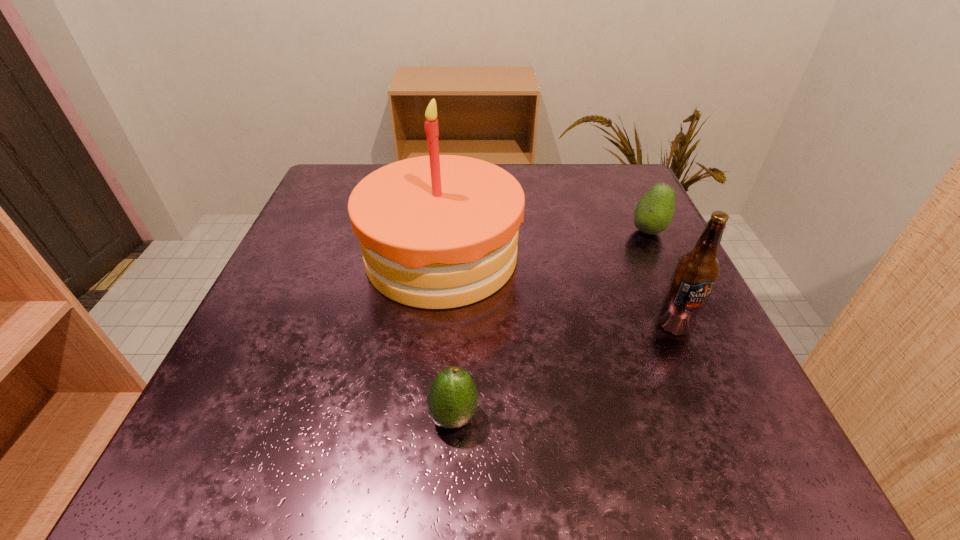
Find the location of a particular element. Image resolution: width=960 pixels, height=540 pixels. object that is the nearest to the tallest object is located at coordinates (452, 397).

Locate which object ranks second in proximity to the nearer avocado. Please provide its 2D coordinates. Your answer should be formatted as a tuple, i.e. [(x, y)], where the tuple contains the x and y coordinates of a point satisfying the conditions above.

[(696, 273)]

You are a GUI agent. You are given a task and a screenshot of the screen. Output one action in this format:
    pyautogui.click(x=<x>, y=<y>)
    Task: Click on the vacant space that satisfies the following two spatial constraints: 1. on the back side of the shorter avocado; 2. on the left side of the right avocado
    This screenshot has height=540, width=960.
    Given the screenshot: What is the action you would take?
    pyautogui.click(x=463, y=232)

The image size is (960, 540). Identify the location of blank space that satisfies the following two spatial constraints: 1. on the front side of the tallest object; 2. on the left side of the nearest object. (425, 416).

Identify the location of free region that satisfies the following two spatial constraints: 1. on the back side of the right avocado; 2. on the left side of the left avocado. (463, 232).